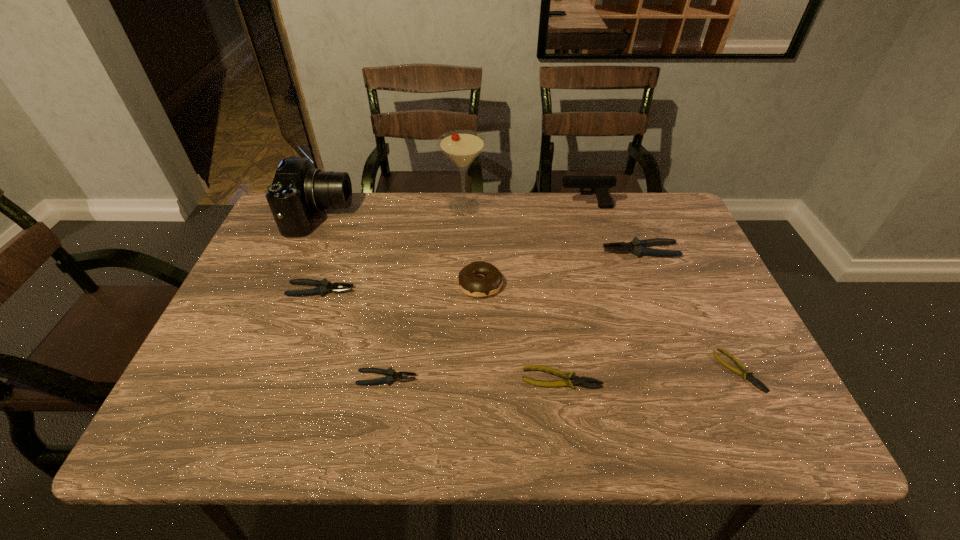
Locate an element on the screen. The image size is (960, 540). free space located 0.110m on the front of the doughnut is located at coordinates (480, 335).

Where is `free space located 0.390m at the gripping part of the biggest gray pliers`? free space located 0.390m at the gripping part of the biggest gray pliers is located at coordinates (464, 251).

Where is `free space located 0.070m at the gripping part of the biggest gray pliers`? This screenshot has height=540, width=960. free space located 0.070m at the gripping part of the biggest gray pliers is located at coordinates (578, 251).

Locate an element on the screen. Image resolution: width=960 pixels, height=540 pixels. free region located 0.360m at the gripping part of the biggest gray pliers is located at coordinates (474, 251).

Image resolution: width=960 pixels, height=540 pixels. What are the coordinates of `free space located at the gripping part of the leftmost gray pliers` in the screenshot? It's located at (x=389, y=290).

Where is `free space located 0.050m at the gripping part of the fourth pliers from right to left`? free space located 0.050m at the gripping part of the fourth pliers from right to left is located at coordinates (440, 378).

The width and height of the screenshot is (960, 540). I want to click on free space located 0.330m on the right of the bigger yellow pliers, so pos(755,379).

Image resolution: width=960 pixels, height=540 pixels. Identify the location of free location located 0.200m on the left of the smaller yellow pliers. (627, 370).

Where is `martini that is at the far edge`? The height and width of the screenshot is (540, 960). martini that is at the far edge is located at coordinates (462, 147).

Where is `camera that is at the far edge`? camera that is at the far edge is located at coordinates (298, 190).